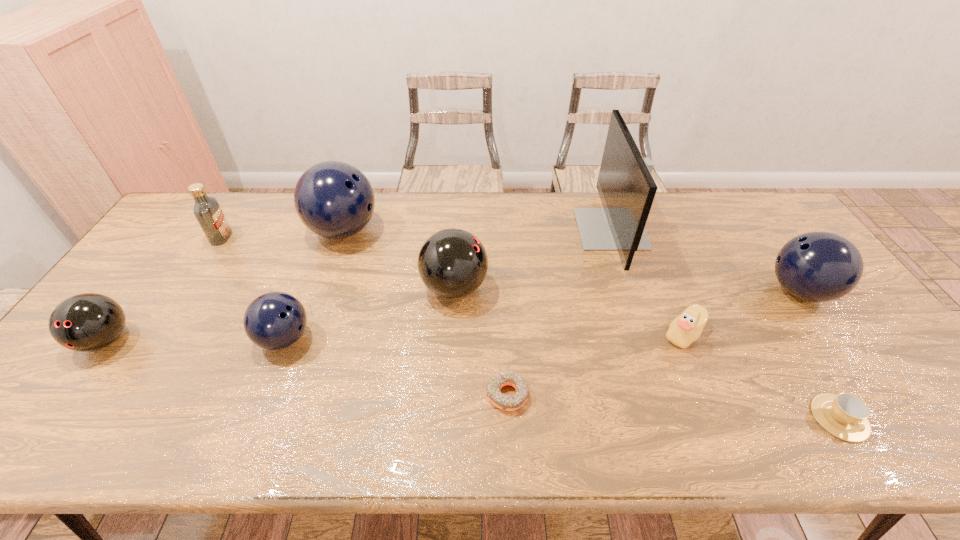
This screenshot has height=540, width=960. Identify the location of the tallest object. (626, 187).

Where is `the farthest bowling ball`? This screenshot has width=960, height=540. the farthest bowling ball is located at coordinates (333, 199).

Where is `the biggest blue bowling ball`? This screenshot has width=960, height=540. the biggest blue bowling ball is located at coordinates (333, 199).

Where is `the ninth object from right to left`? This screenshot has width=960, height=540. the ninth object from right to left is located at coordinates (207, 210).

At what (x,y) coordinates should I click in order to perform the action: click on the second smallest blue bowling ball. Please return your answer as a coordinate pair (x, y). This screenshot has width=960, height=540. Looking at the image, I should click on (818, 266).

Find the location of a particular element. the rightmost blue bowling ball is located at coordinates (818, 266).

The image size is (960, 540). What are the coordinates of `the bigger black bowling ball` in the screenshot? It's located at (452, 263).

Find the location of a particular element. The height and width of the screenshot is (540, 960). the right black bowling ball is located at coordinates 452,263.

This screenshot has width=960, height=540. In order to click on the leftmost object in this screenshot , I will do `click(86, 322)`.

This screenshot has width=960, height=540. I want to click on the leftmost bowling ball, so click(86, 322).